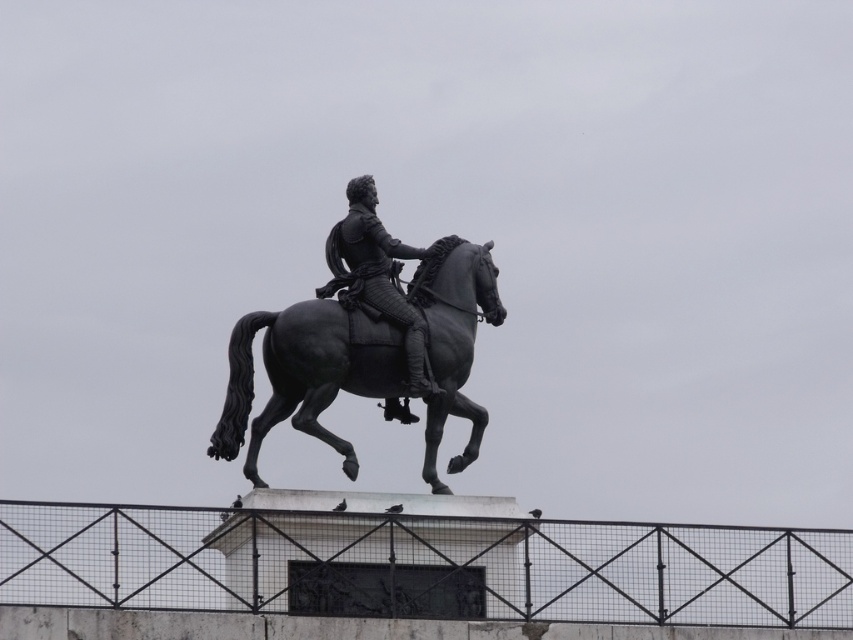
Question: Which object is farther from the camera taking this photo?

Choices:
 (A) polished black horse at center
 (B) polished bronze statue at center

Answer: (B)

Question: Which point appears farthest from the camera in this image?

Choices:
 (A) coord(238,337)
 (B) coord(842,532)

Answer: (B)

Question: Which point appears farthest from the camera in this image?

Choices:
 (A) (363, 246)
 (B) (840, 570)

Answer: (A)

Question: Is black metal fence at center below polished bronze statue at center?

Choices:
 (A) yes
 (B) no

Answer: (A)

Question: Does black metal fence at center have a lesser width compared to polished black horse at center?

Choices:
 (A) no
 (B) yes

Answer: (A)

Question: Does polished black horse at center appear over polished bronze statue at center?

Choices:
 (A) no
 (B) yes

Answer: (A)